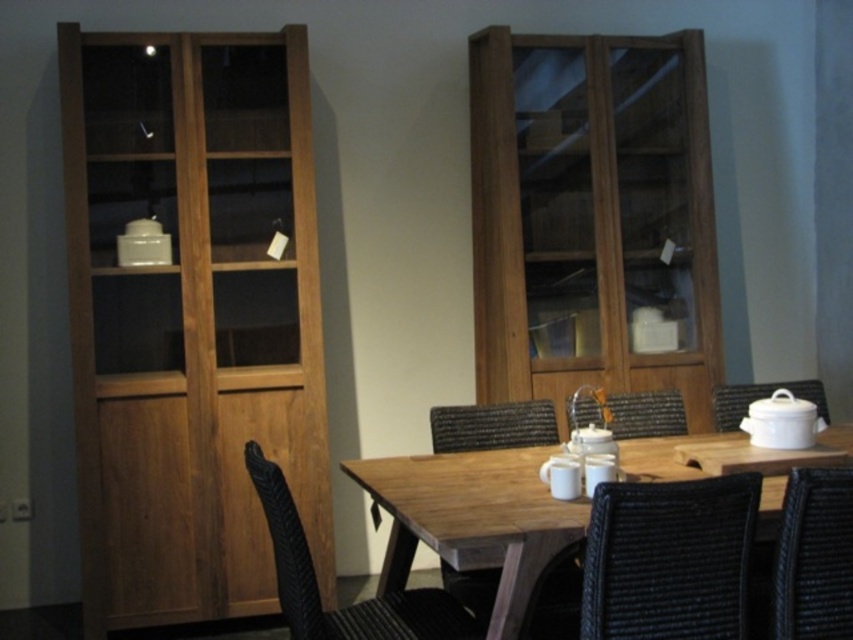
This screenshot has height=640, width=853. Find the location of `black woven chair at lower right`. black woven chair at lower right is located at coordinates (811, 557).

Is black woven chair at lower right to the left of white ceramic pot at right from the viewer's perspective?

Indeed, black woven chair at lower right is positioned on the left side of white ceramic pot at right.

At what (x,y) coordinates should I click in order to perform the action: click on black woven chair at lower right. Please return your answer as a coordinate pair (x, y). Looking at the image, I should click on (811, 557).

The image size is (853, 640). Describe the element at coordinates (630, 413) in the screenshot. I see `woven rattan chair at center` at that location.

Find the location of a particular element. This screenshot has height=640, width=853. woven rattan chair at center is located at coordinates (630, 413).

Between point (677, 406) and point (822, 412), which one is positioned in front?

Point (822, 412)

Locate an element on the screen. woven rattan chair at center is located at coordinates (630, 413).

Can you confirm if rattan chair at center is taller than woven rattan chair at center?

Correct, rattan chair at center is much taller as woven rattan chair at center.

Does rattan chair at center appear on the right side of woven rattan chair at center?

In fact, rattan chair at center is to the left of woven rattan chair at center.

Which is behind, point (581, 600) or point (654, 413)?

The point (654, 413) is more distant.

Locate an element on the screen. Image resolution: width=853 pixels, height=640 pixels. rattan chair at center is located at coordinates (666, 560).